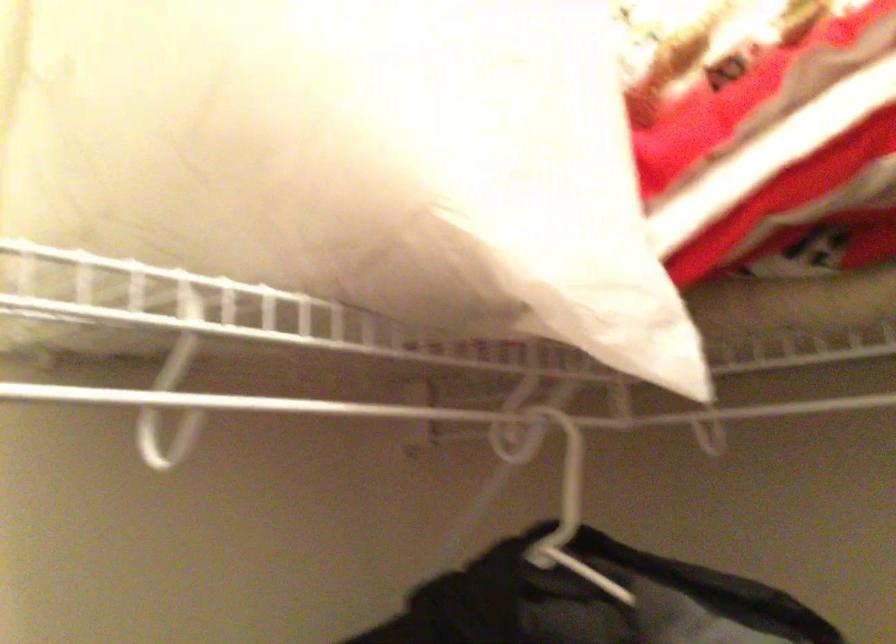
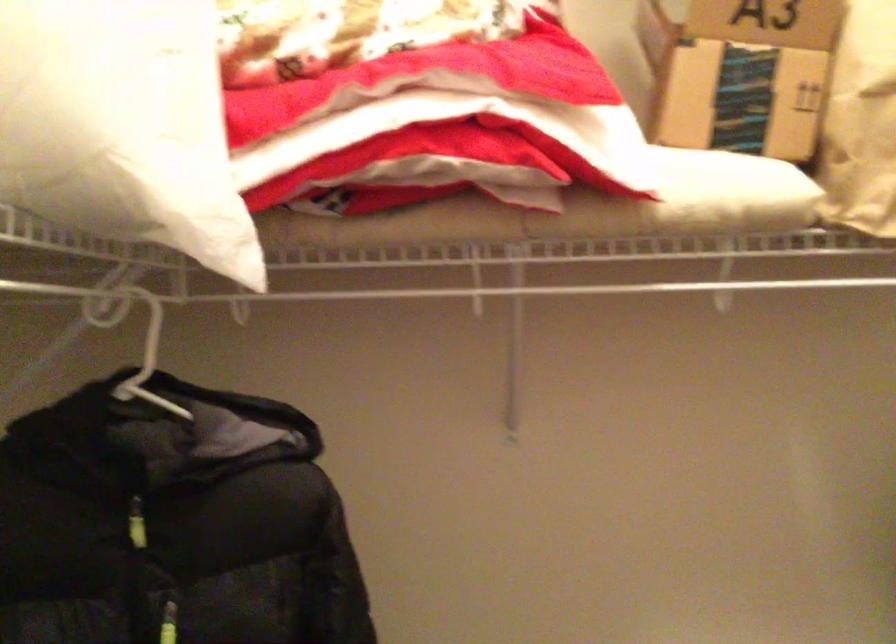
Question: The first image is from the beginning of the video and the second image is from the end. How did the camera likely rotate when shooting the video?

Choices:
 (A) Left
 (B) Right
 (C) Up
 (D) Down

Answer: (B)